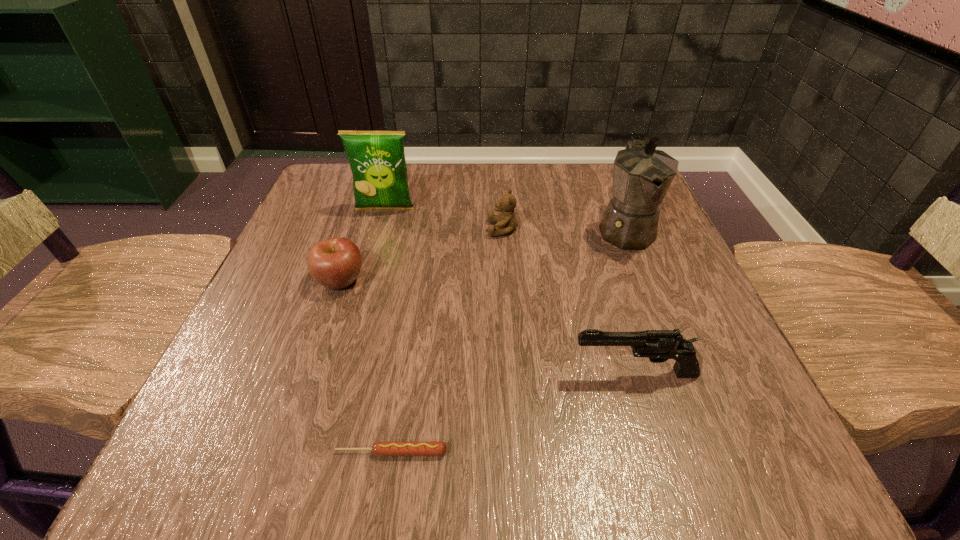
You are a GUI agent. You are given a task and a screenshot of the screen. Output one action in this format:
    pyautogui.click(x=<x>, y=<y>)
    Task: Click on the object at the near edge
    Image resolution: width=960 pixels, height=540 pixels.
    Given the screenshot: What is the action you would take?
    pyautogui.click(x=381, y=448)

This screenshot has width=960, height=540. Find the location of `crisp (potato chip) that is at the left edge`. crisp (potato chip) that is at the left edge is located at coordinates (377, 160).

Locate an element on the screen. Image resolution: width=960 pixels, height=540 pixels. apple present at the left edge is located at coordinates (335, 263).

Where is `coffeepot positioned at the right edge`? The height and width of the screenshot is (540, 960). coffeepot positioned at the right edge is located at coordinates (642, 175).

Locate an element on the screen. gun present at the right edge is located at coordinates (658, 345).

Where is `object that is at the far left corner`? This screenshot has width=960, height=540. object that is at the far left corner is located at coordinates (377, 160).

Where is `object that is at the far right corner`? object that is at the far right corner is located at coordinates (642, 175).

In the image, there is a desktop. Identify the location of vacant space at the far edge. (556, 188).

The height and width of the screenshot is (540, 960). I want to click on free space at the left edge of the desktop, so click(x=310, y=227).

The image size is (960, 540). I want to click on blank space at the right edge of the desktop, so click(x=742, y=374).